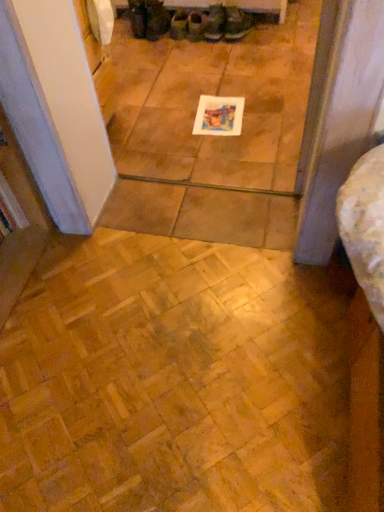
I want to click on free space between white paper at center and leather boot at center, the 5th footwear when ordered from left to right, so click(223, 76).